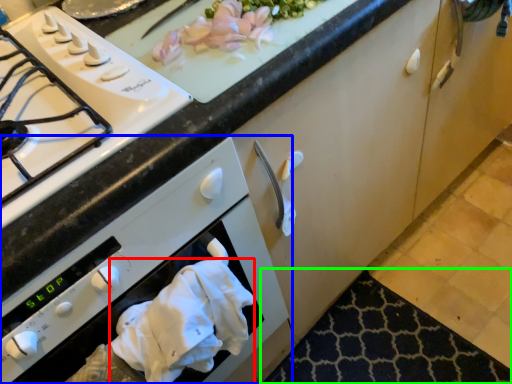
Question: Considering the real-world distances, which object is closest to hand towel (highlighted by a red box)? oven (highlighted by a blue box) or mat (highlighted by a green box).

Choices:
 (A) oven
 (B) mat

Answer: (A)